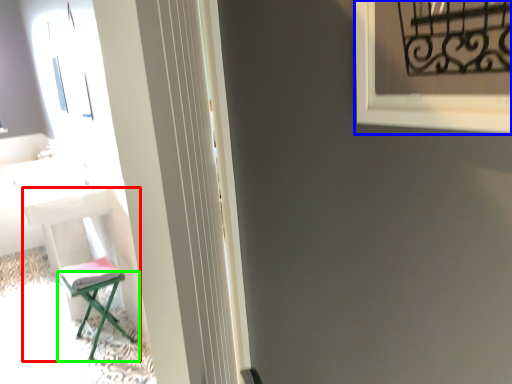
Question: Which object is positioned closest to furniture (highlighted by a red box)? Select from window frame (highlighted by a blue box) and furniture (highlighted by a green box).

Choices:
 (A) window frame
 (B) furniture

Answer: (B)